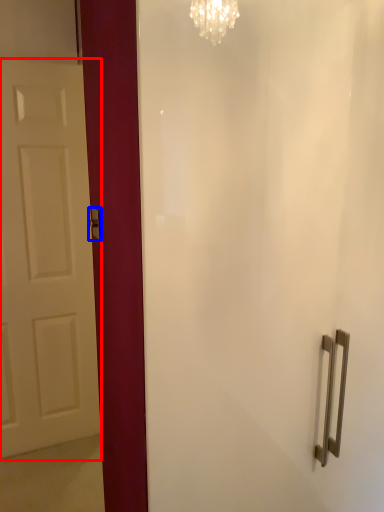
Question: Which point is further to the camera, door (highlighted by a red box) or door handle (highlighted by a blue box)?

Choices:
 (A) door
 (B) door handle

Answer: (A)